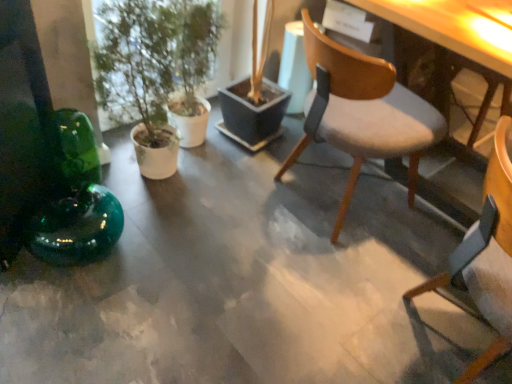
Question: Is light gray fabric chair at center, the first chair in the back-to-front sequence, positioned in front of wooden chair at center, which is the second chair in back-to-front order?

Choices:
 (A) yes
 (B) no

Answer: (B)

Question: From the image's perspective, is light gray fabric chair at center, which is the 2th chair from front to back, above wooden chair at center, which is the second chair in back-to-front order?

Choices:
 (A) no
 (B) yes

Answer: (B)

Question: Considering the relative sizes of light gray fabric chair at center, the first chair in the back-to-front sequence, and wooden chair at center, the first chair when ordered from front to back, in the image provided, is light gray fabric chair at center, the first chair in the back-to-front sequence, bigger than wooden chair at center, the first chair when ordered from front to back,?

Choices:
 (A) yes
 (B) no

Answer: (A)

Question: Is light gray fabric chair at center, which is the 2th chair from front to back, wider than wooden chair at center, the first chair when ordered from front to back?

Choices:
 (A) no
 (B) yes

Answer: (B)

Question: Does light gray fabric chair at center, which is the 2th chair from front to back, contain wooden chair at center, which is the second chair in back-to-front order?

Choices:
 (A) no
 (B) yes

Answer: (A)

Question: Is light gray fabric chair at center, which is the 2th chair from front to back, oriented towards wooden chair at center, the first chair when ordered from front to back?

Choices:
 (A) yes
 (B) no

Answer: (B)

Question: Is the depth of wooden chair at center, which is the second chair in back-to-front order, less than that of light gray fabric chair at center, which is the 2th chair from front to back?

Choices:
 (A) yes
 (B) no

Answer: (A)

Question: Could you tell me if wooden chair at center, the first chair when ordered from front to back, is facing light gray fabric chair at center, which is the 2th chair from front to back?

Choices:
 (A) no
 (B) yes

Answer: (A)

Question: Can you confirm if wooden chair at center, the first chair when ordered from front to back, is taller than light gray fabric chair at center, which is the 2th chair from front to back?

Choices:
 (A) yes
 (B) no

Answer: (A)

Question: Is light gray fabric chair at center, the first chair in the back-to-front sequence, surrounded by wooden chair at center, the first chair when ordered from front to back?

Choices:
 (A) yes
 (B) no

Answer: (B)

Question: Is wooden chair at center, which is the second chair in back-to-front order, turned away from light gray fabric chair at center, which is the 2th chair from front to back?

Choices:
 (A) yes
 (B) no

Answer: (B)

Question: Can you confirm if wooden chair at center, the first chair when ordered from front to back, is shorter than light gray fabric chair at center, the first chair in the back-to-front sequence?

Choices:
 (A) yes
 (B) no

Answer: (B)

Question: Can you confirm if light gray fabric chair at center, which is the 2th chair from front to back, is smaller than green matte plant at left?

Choices:
 (A) no
 (B) yes

Answer: (A)